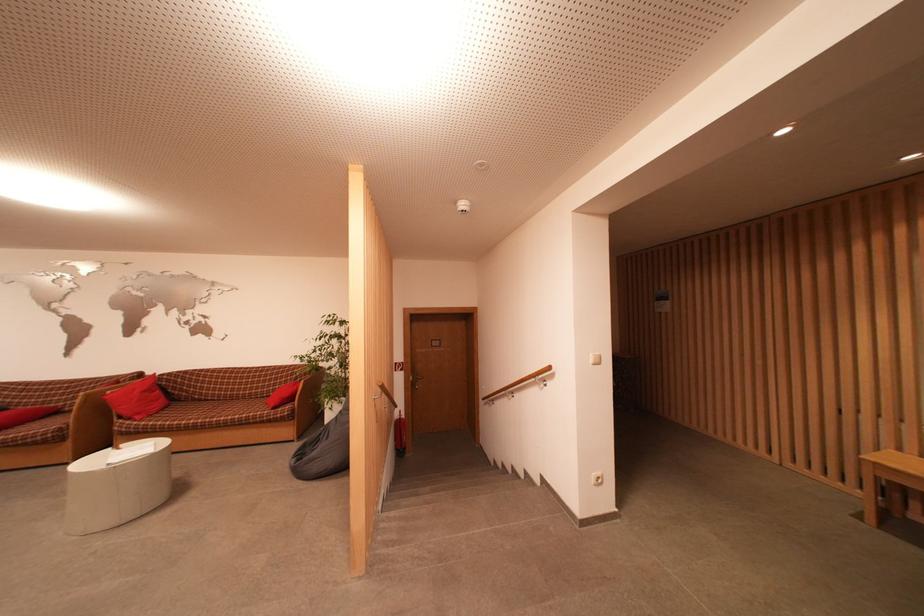
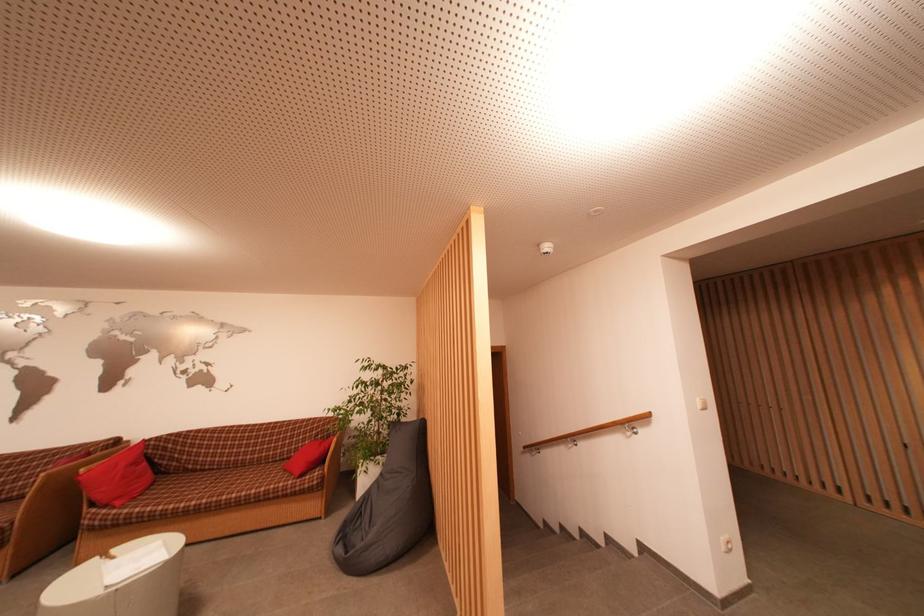
Question: I am providing you with two images of the same scene from different viewpoints. After the viewpoint changes to image2, which objects are now occluded?

Choices:
 (A) slatted door handle
 (B) red pillow
 (C) sofa sitting surface
 (D) none of these

Answer: (D)